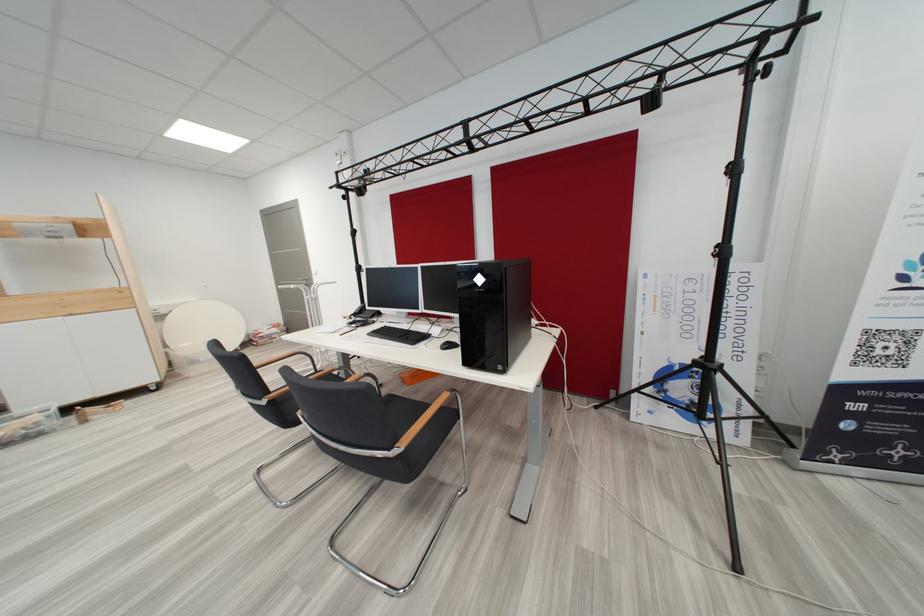
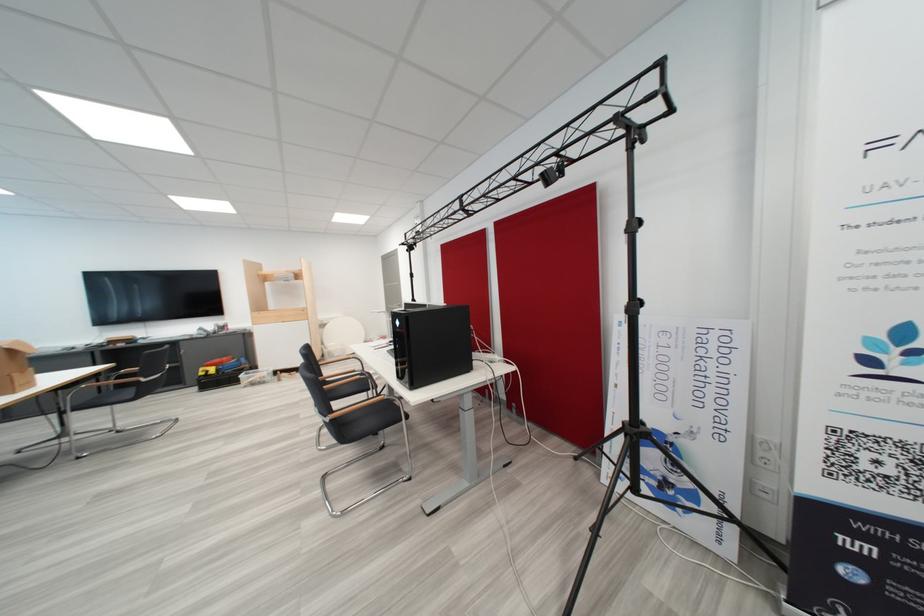
In the second image, find the point that corresponds to (x=748, y=360) in the first image.

(731, 439)